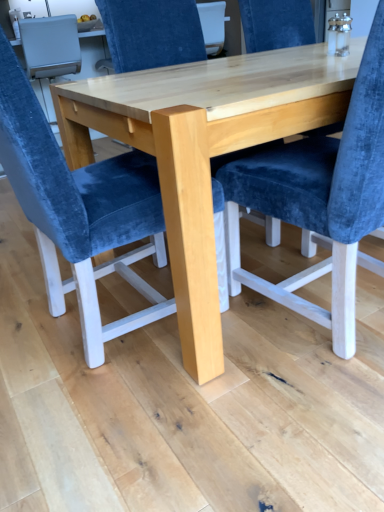
At what (x,y) coordinates should I click in order to perform the action: click on free space in front of velvet blue chair at center, the 2th chair viewed from the back. Please return your answer as a coordinate pair (x, y). The width and height of the screenshot is (384, 512). Looking at the image, I should click on (127, 423).